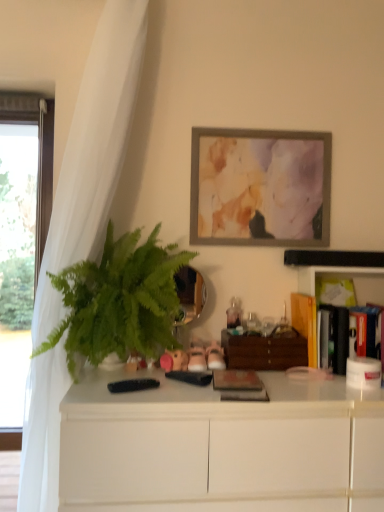
Question: Is rustic wooden book at center, which ranks as the third book in back-to-front order, positioned with its back to hardcover book at right, arranged as the second book when viewed from the back?

Choices:
 (A) yes
 (B) no

Answer: (B)

Question: Is rustic wooden book at center, which appears as the 1th book when viewed from the left, outside of hardcover book at right, arranged as the second book when viewed from the back?

Choices:
 (A) no
 (B) yes

Answer: (B)

Question: Is rustic wooden book at center, which ranks as the third book in back-to-front order, at the right side of hardcover book at right, arranged as the second book when viewed from the back?

Choices:
 (A) yes
 (B) no

Answer: (B)

Question: Does rustic wooden book at center, arranged as the 1th book when viewed from the front, have a lesser width compared to hardcover book at right, which ranks as the 3th book in left-to-right order?

Choices:
 (A) yes
 (B) no

Answer: (A)

Question: Is the depth of rustic wooden book at center, acting as the third book starting from the right, greater than that of hardcover book at right, arranged as the second book when viewed from the back?

Choices:
 (A) no
 (B) yes

Answer: (A)

Question: Is rustic wooden book at center, acting as the third book starting from the right, touching hardcover book at right, arranged as the second book when viewed from the back?

Choices:
 (A) no
 (B) yes

Answer: (A)

Question: Does rustic wooden book at center, which ranks as the third book in back-to-front order, turn towards green leafy plant at left?

Choices:
 (A) yes
 (B) no

Answer: (B)

Question: Is rustic wooden book at center, acting as the third book starting from the right, wider than green leafy plant at left?

Choices:
 (A) yes
 (B) no

Answer: (B)

Question: Is green leafy plant at left at the back of rustic wooden book at center, acting as the third book starting from the right?

Choices:
 (A) no
 (B) yes

Answer: (A)

Question: Considering the relative positions of rustic wooden book at center, which appears as the 1th book when viewed from the left, and green leafy plant at left in the image provided, is rustic wooden book at center, which appears as the 1th book when viewed from the left, to the right of green leafy plant at left from the viewer's perspective?

Choices:
 (A) no
 (B) yes

Answer: (B)

Question: From a real-world perspective, does rustic wooden book at center, arranged as the 1th book when viewed from the front, sit lower than green leafy plant at left?

Choices:
 (A) no
 (B) yes

Answer: (B)

Question: Is green leafy plant at left turned away from rustic wooden book at center, acting as the third book starting from the right?

Choices:
 (A) yes
 (B) no

Answer: (B)